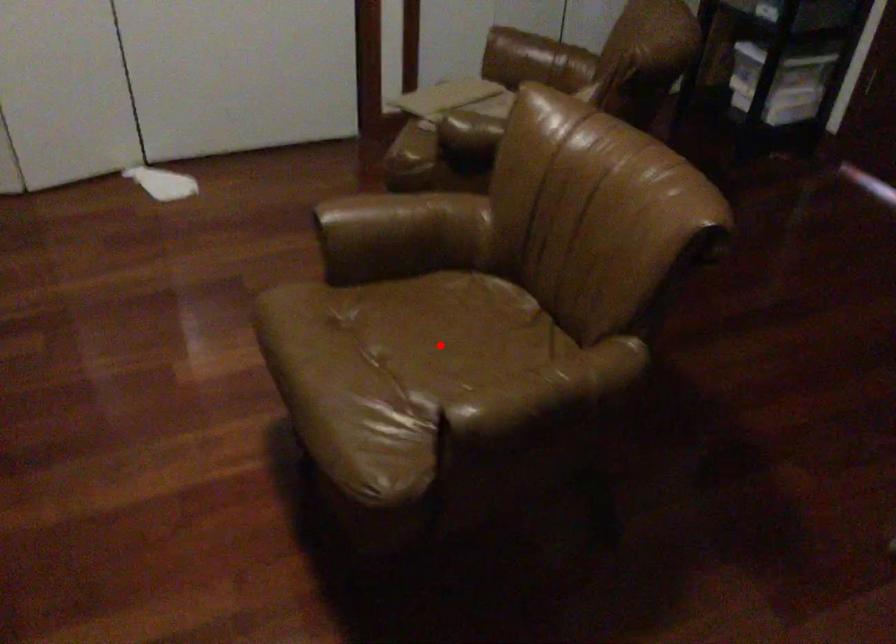
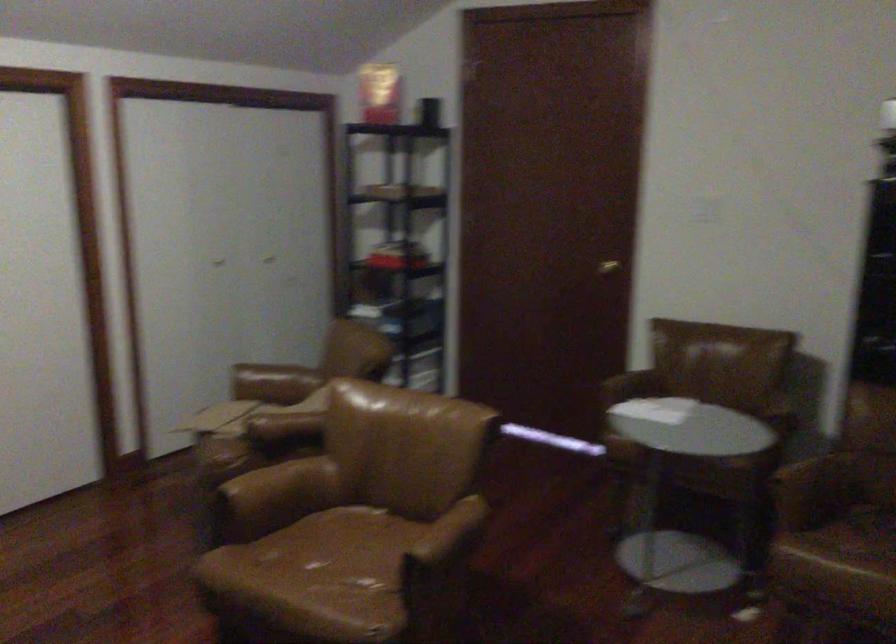
Locate, in the second image, the point that corresponds to the highlighted location in the first image.

(343, 556)